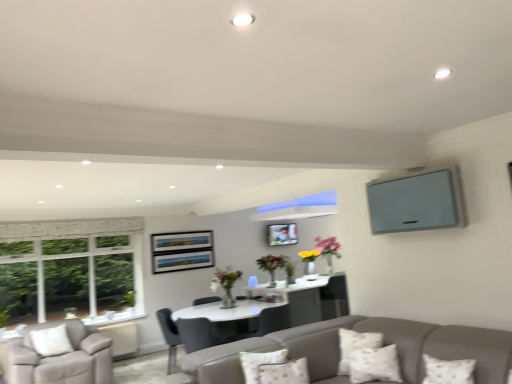
Question: Is matte gray tv at upper right closer to camera compared to fluffy white pillow at lower center, placed as the third pillow when sorted from right to left?

Choices:
 (A) yes
 (B) no

Answer: (B)

Question: Does matte gray tv at upper right appear on the right side of fluffy white pillow at lower center, which is counted as the first pillow, starting from the left?

Choices:
 (A) yes
 (B) no

Answer: (A)

Question: From a real-world perspective, is matte gray tv at upper right located beneath fluffy white pillow at lower center, placed as the third pillow when sorted from right to left?

Choices:
 (A) yes
 (B) no

Answer: (B)

Question: Is matte gray tv at upper right behind fluffy white pillow at lower center, which is counted as the first pillow, starting from the left?

Choices:
 (A) yes
 (B) no

Answer: (A)

Question: Is matte gray tv at upper right to the left of fluffy white pillow at lower center, placed as the third pillow when sorted from right to left, from the viewer's perspective?

Choices:
 (A) no
 (B) yes

Answer: (A)

Question: Is white textured pillow at lower center, which is the third pillow from left to right, situated inside fluffy white pillow at lower center, placed as the third pillow when sorted from right to left, or outside?

Choices:
 (A) outside
 (B) inside

Answer: (A)

Question: From a real-world perspective, is white textured pillow at lower center, the 1th pillow positioned from the right, physically located above or below fluffy white pillow at lower center, placed as the third pillow when sorted from right to left?

Choices:
 (A) below
 (B) above

Answer: (A)

Question: Is point (x=391, y=354) closer or farther from the camera than point (x=262, y=379)?

Choices:
 (A) closer
 (B) farther

Answer: (B)

Question: From their relative heights in the image, would you say white textured pillow at lower center, the 1th pillow positioned from the right, is taller or shorter than fluffy white pillow at lower center, placed as the third pillow when sorted from right to left?

Choices:
 (A) tall
 (B) short

Answer: (A)

Question: Considering the positions of fluffy white pillow at lower center, which is counted as the first pillow, starting from the left, and white textured pillow at lower center, which is the third pillow from left to right, in the image, is fluffy white pillow at lower center, which is counted as the first pillow, starting from the left, wider or thinner than white textured pillow at lower center, which is the third pillow from left to right,?

Choices:
 (A) thin
 (B) wide

Answer: (A)

Question: Is point (293, 360) positioned closer to the camera than point (369, 350)?

Choices:
 (A) farther
 (B) closer

Answer: (B)

Question: From their relative heights in the image, would you say fluffy white pillow at lower center, which is counted as the first pillow, starting from the left, is taller or shorter than white textured pillow at lower center, the 1th pillow positioned from the right?

Choices:
 (A) tall
 (B) short

Answer: (B)

Question: Considering their positions, is fluffy white pillow at lower center, which is counted as the first pillow, starting from the left, located in front of or behind white textured pillow at lower center, which is the third pillow from left to right?

Choices:
 (A) front
 (B) behind

Answer: (A)

Question: Does point (359, 337) appear closer or farther from the camera than point (459, 206)?

Choices:
 (A) closer
 (B) farther

Answer: (B)

Question: From a real-world perspective, is white textured pillow at lower right, arranged as the 2th pillow when viewed from the left, above or below matte gray tv at upper right?

Choices:
 (A) below
 (B) above

Answer: (A)